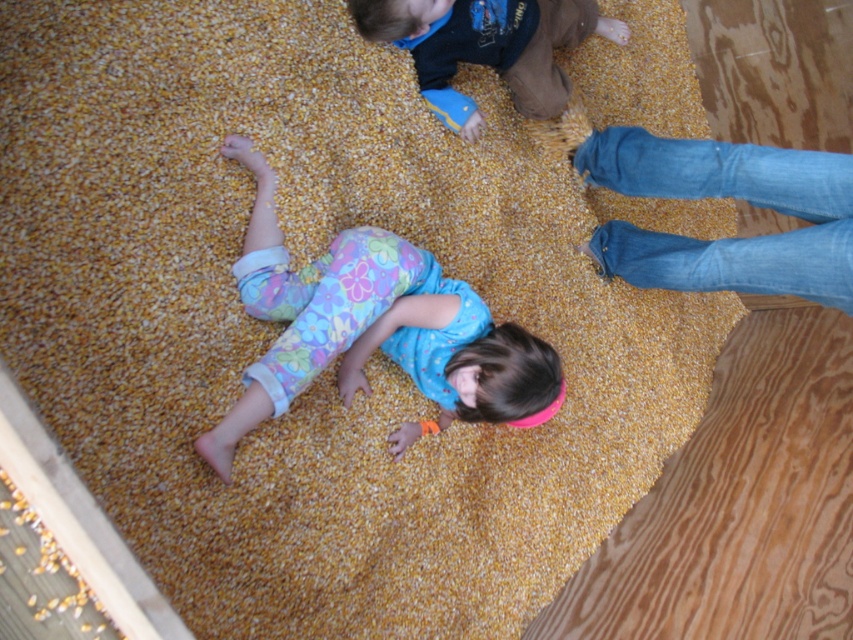
You are a photographer trying to capture a closeup of the corn pile. You notice two points marked in the image. Which point, point (263, 390) or point (482, 29), is better positioned for a closeup shot?

Point (263, 390) is closer to the camera than point (482, 29), so it is better positioned for a closeup shot.